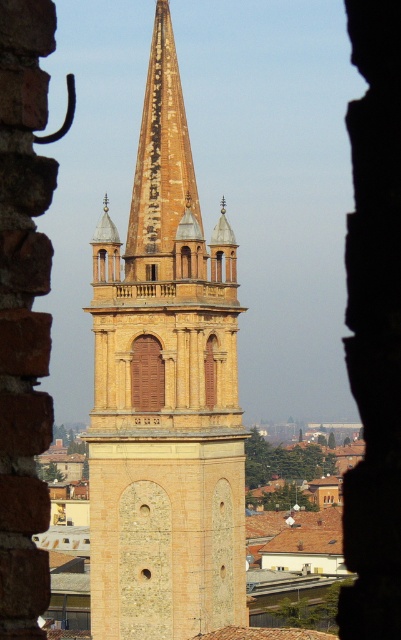
You are an architect examining a historical building. You notice the yellow stone tower at center and the matte wood window at center. Based on their positions, which object is closer to the viewer?

The matte wood window at center is closer to the viewer because the yellow stone tower at center is positioned under it, indicating it is behind the window.

You are standing inside a historic building and looking through a stone window frame. You see a point marked at coordinates (166,396) in the scene. Based on the description, what architectural feature does this point most likely represent?

The point at (166,396) corresponds to the yellow stone tower at center, which is the central feature of the scene.